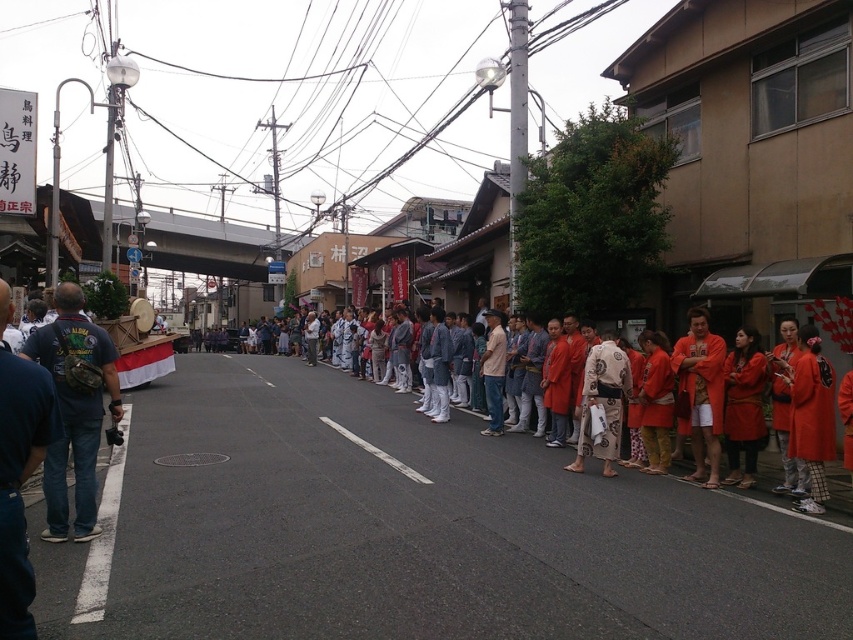
You are a photographer trying to capture the festival scene. You notice the orange cotton kimono at center and the blue jeans at lower left. Which of these two items should you focus on if you want to photograph something that takes up more space in the frame?

The blue jeans at lower left should be focused on because it is larger than the orange cotton kimono at center.